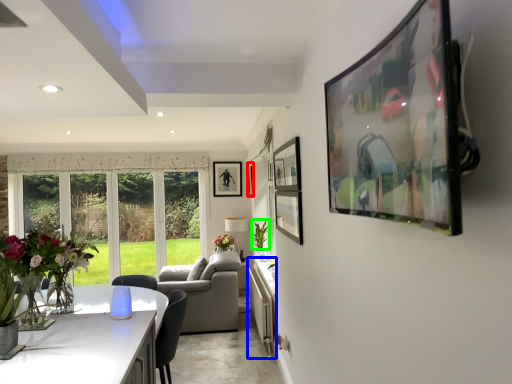
Question: Based on their relative distances, which object is farther from picture frame (highlighted by a red box)? Choose from counter top (highlighted by a blue box) and plant (highlighted by a green box).

Choices:
 (A) counter top
 (B) plant

Answer: (A)